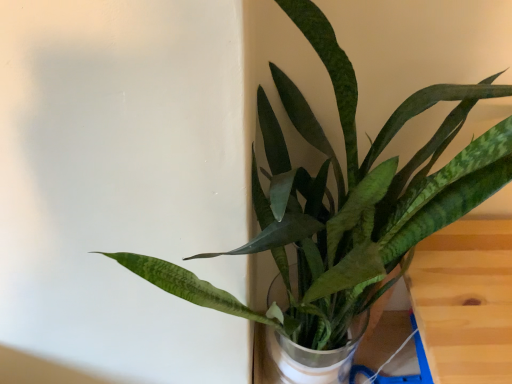
I want to click on vacant area on top of wooden table at lower right (from a real-world perspective), so click(478, 276).